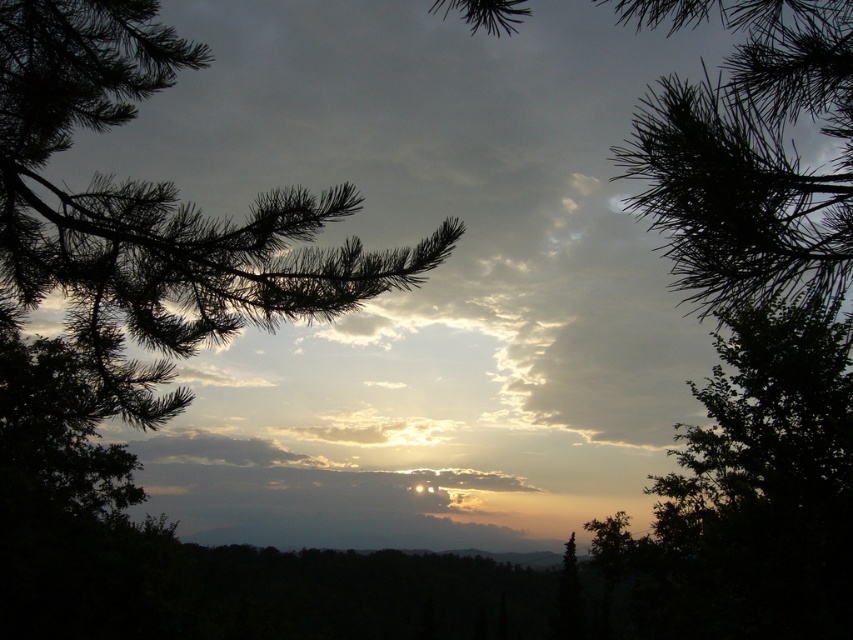
Question: Which of the following is the farthest from the observer?

Choices:
 (A) silvery needles at center
 (B) dark green needles at center

Answer: (A)

Question: Can you confirm if silvery needles at center is positioned above dark green needles at center?

Choices:
 (A) yes
 (B) no

Answer: (B)

Question: Does silvery needles at center appear on the right side of dark green needles at center?

Choices:
 (A) no
 (B) yes

Answer: (A)

Question: Is silvery needles at center below dark green needles at center?

Choices:
 (A) no
 (B) yes

Answer: (B)